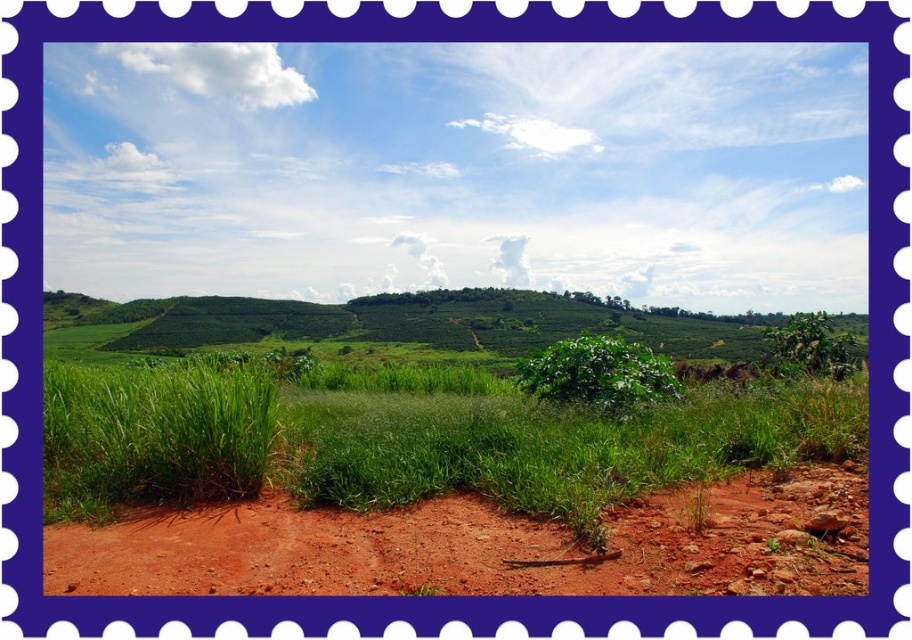
Question: Can you confirm if reddish-brown soil at lower center is positioned above green leafy bush at center?

Choices:
 (A) yes
 (B) no

Answer: (B)

Question: Which of the following is the closest to the observer?

Choices:
 (A) green leafy bush at center
 (B) green leafy grass at center
 (C) green grassy hillside at center
 (D) reddish-brown soil at lower center

Answer: (D)

Question: Does reddish-brown soil at lower center have a greater width compared to green leafy bush at center?

Choices:
 (A) yes
 (B) no

Answer: (A)

Question: Which of the following is the farthest from the observer?

Choices:
 (A) (602, 353)
 (B) (397, 330)
 (C) (389, 422)

Answer: (B)

Question: Is green leafy grass at center positioned in front of reddish-brown soil at lower center?

Choices:
 (A) yes
 (B) no

Answer: (B)

Question: Which is nearer to the green leafy grass at center?

Choices:
 (A) reddish-brown soil at lower center
 (B) green grassy hillside at center
 (C) green leafy bush at center

Answer: (A)